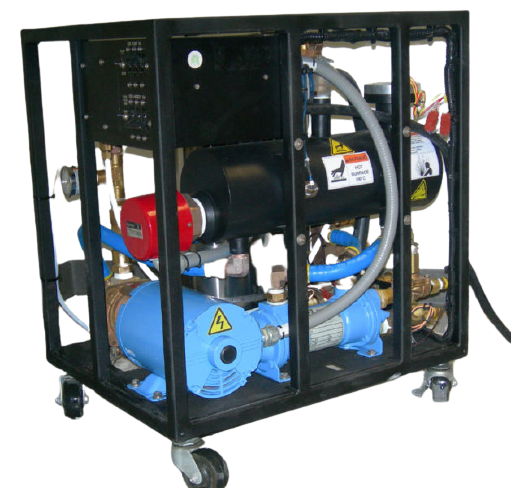
I want to click on tubbing of some sort, so click(x=391, y=220), click(x=330, y=274), click(x=114, y=240), click(x=66, y=310).